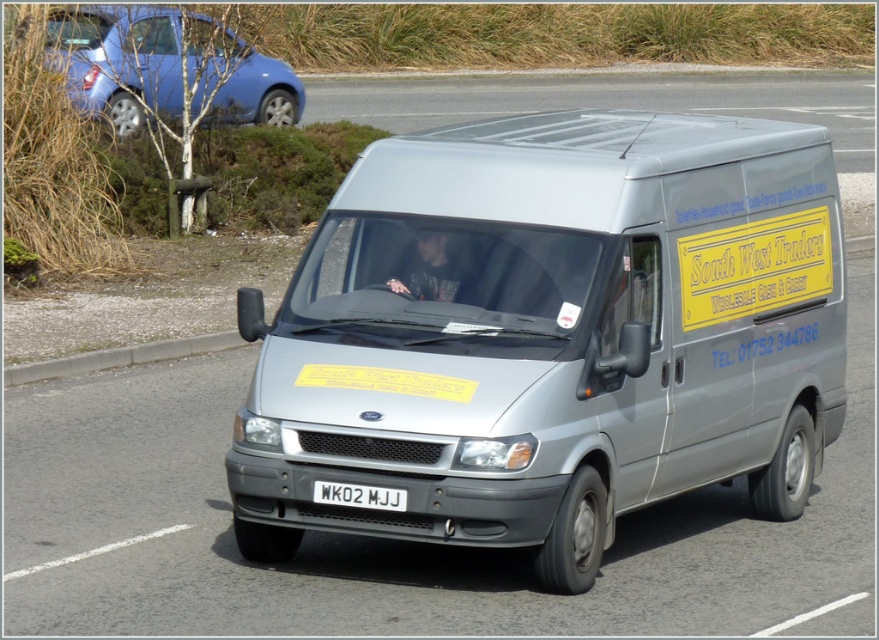
Question: Considering the relative positions of gray concrete curb at lower left and white plastic license plate at center in the image provided, where is gray concrete curb at lower left located with respect to white plastic license plate at center?

Choices:
 (A) right
 (B) left

Answer: (B)

Question: Which point appears closest to the camera in this image?

Choices:
 (A) (328, 502)
 (B) (774, 321)
 (C) (8, 380)

Answer: (A)

Question: Does metallic blue hatchback at upper left have a lesser width compared to white plastic license plate at center?

Choices:
 (A) no
 (B) yes

Answer: (A)

Question: Does metallic blue hatchback at upper left have a smaller size compared to gray concrete curb at lower left?

Choices:
 (A) yes
 (B) no

Answer: (B)

Question: Estimate the real-world distances between objects in this image. Which object is farther from the white plastic license plate at center?

Choices:
 (A) gray concrete curb at lower left
 (B) yellow paper at center
 (C) metallic blue hatchback at upper left
 (D) silver metallic van at center

Answer: (C)

Question: Which of the following is the farthest from the observer?

Choices:
 (A) white plastic license plate at center
 (B) gray concrete curb at lower left
 (C) metallic blue hatchback at upper left
 (D) silver metallic van at center

Answer: (C)